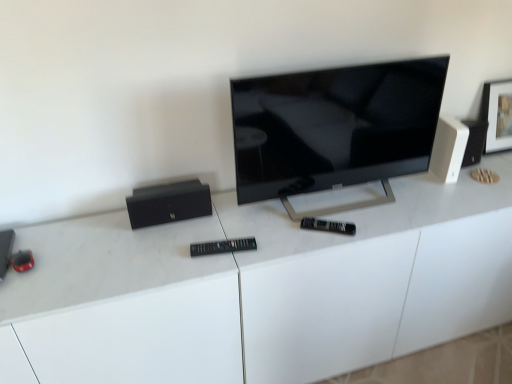
The width and height of the screenshot is (512, 384). Identify the location of vacant area that lies between black matte speaker at left, positioned as the 2th speaker in right-to-left order, and metallic black speaker at left, which is the third speaker in right-to-left order. (83, 243).